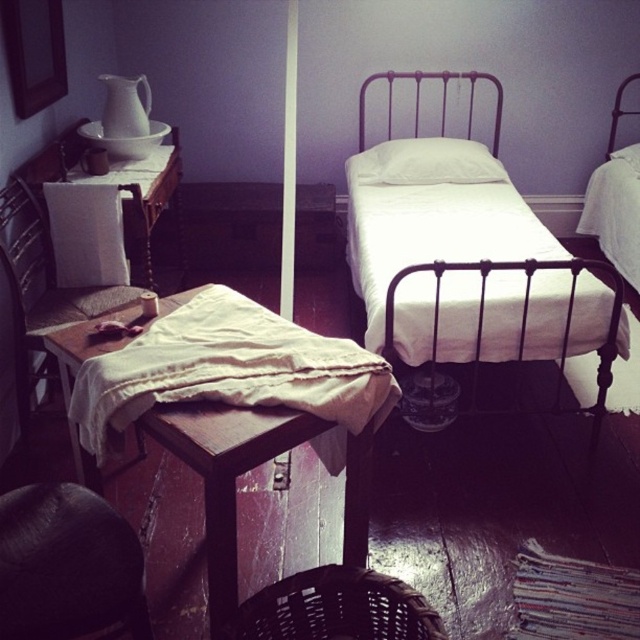
Question: Which of the following is the closest to the observer?

Choices:
 (A) (593, 225)
 (B) (385, 173)
 (C) (611, 156)
 (D) (148, 624)

Answer: (D)

Question: Can you confirm if wooden table at center is positioned to the left of woven brown chair at lower center?

Choices:
 (A) no
 (B) yes

Answer: (B)

Question: Is wooden table at center thinner than white soft pillow at center?

Choices:
 (A) no
 (B) yes

Answer: (A)

Question: Is white matte metal bed at center smaller than wooden woven chair at left?

Choices:
 (A) yes
 (B) no

Answer: (B)

Question: Which point is closer to the camera?

Choices:
 (A) white matte metal bed at center
 (B) wooden woven chair at left

Answer: (B)

Question: Among these objects, which one is farthest from the camera?

Choices:
 (A) white matte metal bed at center
 (B) woven brown chair at lower center
 (C) white soft pillow at center

Answer: (C)